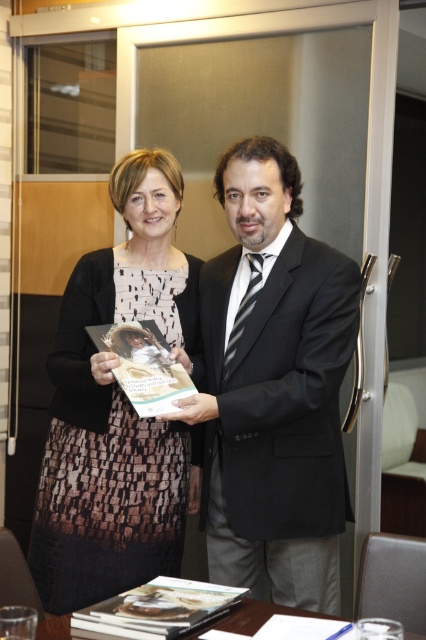
You are an interior designer assessing the spatial compatibility of two items in a room. You notice the black satin suit at center and the printed fabric dress at center. Which item is shorter in height?

The black satin suit at center is not as tall as the printed fabric dress at center, so the black satin suit at center is shorter in height.

You are a photographer setting up for a photoshoot in this room. You have a camera with a 12 inch focus range. You want to capture both the black satin suit at center and the printed fabric dress at center in the same frame without moving the camera. Can you do it?

The black satin suit at center is 11.57 inches away from the printed fabric dress at center. Since the distance between them is within the camera focus range of 12 inches, you can capture both in the same frame without moving the camera.